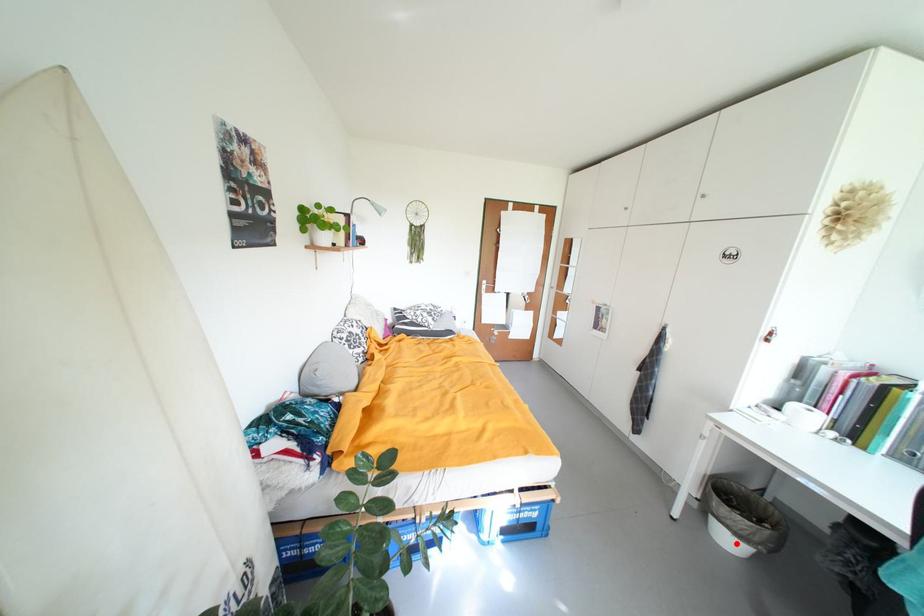
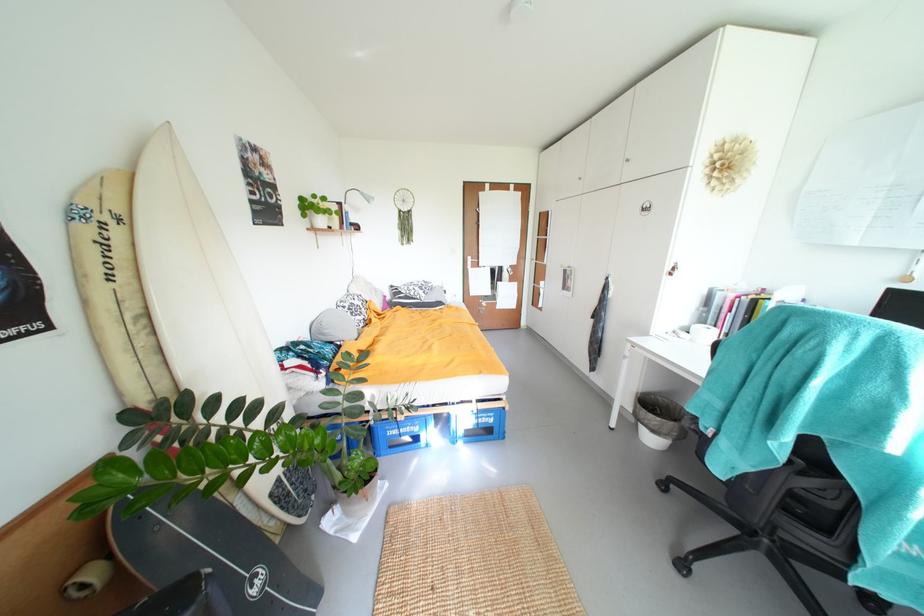
Where in the second image is the point corresponding to the highlighted location from the first image?

(659, 442)